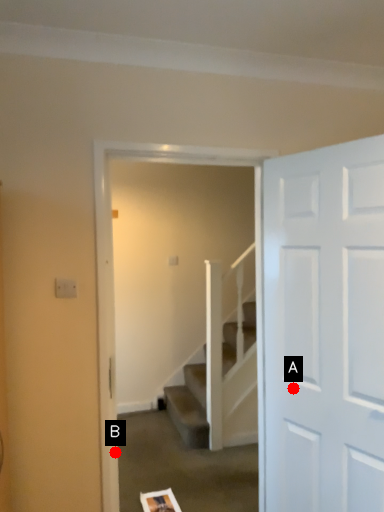
Question: Two points are circled on the image, labeled by A and B beside each circle. Which point is further to the camera?

Choices:
 (A) A is further
 (B) B is further

Answer: (A)